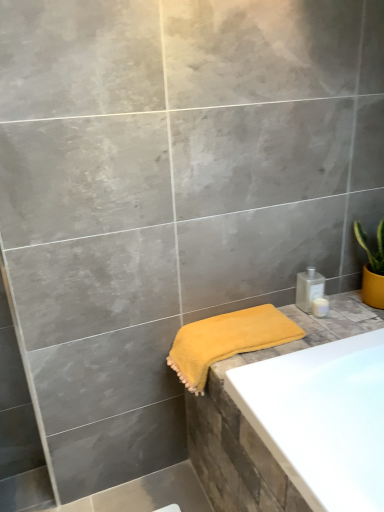
Question: Is satin silver bottle at right, the first toiletry in the top-to-bottom sequence, positioned behind yellow soft towel at lower right?

Choices:
 (A) yes
 (B) no

Answer: (A)

Question: Are satin silver bottle at right, the first toiletry in the top-to-bottom sequence, and yellow soft towel at lower right far apart?

Choices:
 (A) yes
 (B) no

Answer: (B)

Question: Could you tell me if satin silver bottle at right, the first toiletry in the top-to-bottom sequence, is turned towards yellow soft towel at lower right?

Choices:
 (A) yes
 (B) no

Answer: (B)

Question: Can you confirm if satin silver bottle at right, the first toiletry in the top-to-bottom sequence, is shorter than yellow soft towel at lower right?

Choices:
 (A) no
 (B) yes

Answer: (B)

Question: Can we say satin silver bottle at right, the 2th toiletry when ordered from bottom to top, lies outside yellow soft towel at lower right?

Choices:
 (A) yes
 (B) no

Answer: (A)

Question: From the image's perspective, does satin silver bottle at right, the 2th toiletry when ordered from bottom to top, appear higher than yellow soft towel at lower right?

Choices:
 (A) no
 (B) yes

Answer: (B)

Question: Is white glossy soap dispenser at upper right, the second toiletry positioned from the top, positioned beyond the bounds of yellow soft towel at lower right?

Choices:
 (A) no
 (B) yes

Answer: (B)

Question: From a real-world perspective, is white glossy soap dispenser at upper right, the first toiletry when ordered from bottom to top, on yellow soft towel at lower right?

Choices:
 (A) yes
 (B) no

Answer: (A)

Question: Does white glossy soap dispenser at upper right, the first toiletry when ordered from bottom to top, turn towards yellow soft towel at lower right?

Choices:
 (A) yes
 (B) no

Answer: (B)

Question: Considering the relative sizes of white glossy soap dispenser at upper right, the second toiletry positioned from the top, and yellow soft towel at lower right in the image provided, is white glossy soap dispenser at upper right, the second toiletry positioned from the top, thinner than yellow soft towel at lower right?

Choices:
 (A) no
 (B) yes

Answer: (B)

Question: Considering the relative sizes of white glossy soap dispenser at upper right, the first toiletry when ordered from bottom to top, and yellow soft towel at lower right in the image provided, is white glossy soap dispenser at upper right, the first toiletry when ordered from bottom to top, smaller than yellow soft towel at lower right?

Choices:
 (A) yes
 (B) no

Answer: (A)

Question: Does white glossy soap dispenser at upper right, the second toiletry positioned from the top, appear on the right side of yellow soft towel at lower right?

Choices:
 (A) yes
 (B) no

Answer: (A)

Question: Is satin silver bottle at right, the first toiletry in the top-to-bottom sequence, completely or partially inside yellow soft towel at lower right?

Choices:
 (A) yes
 (B) no

Answer: (B)